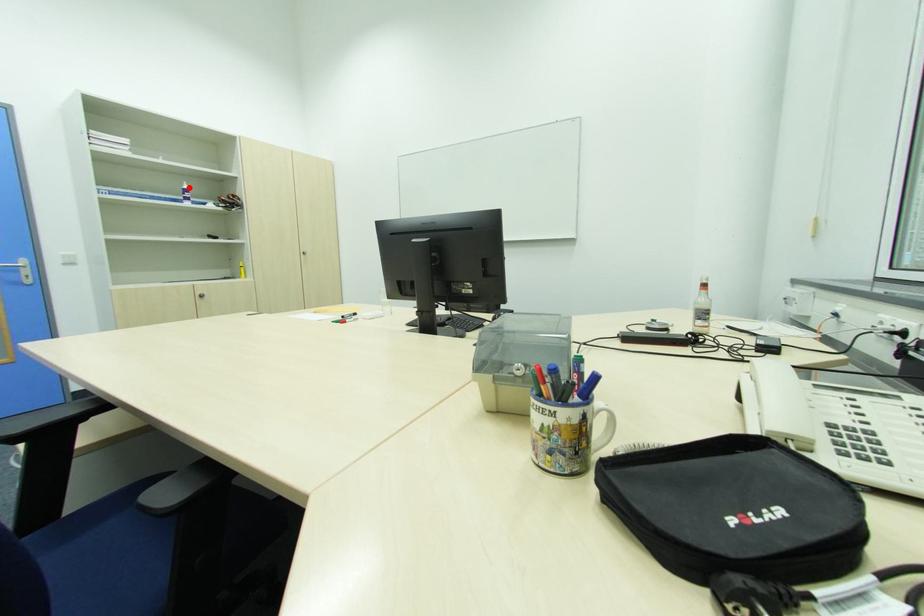
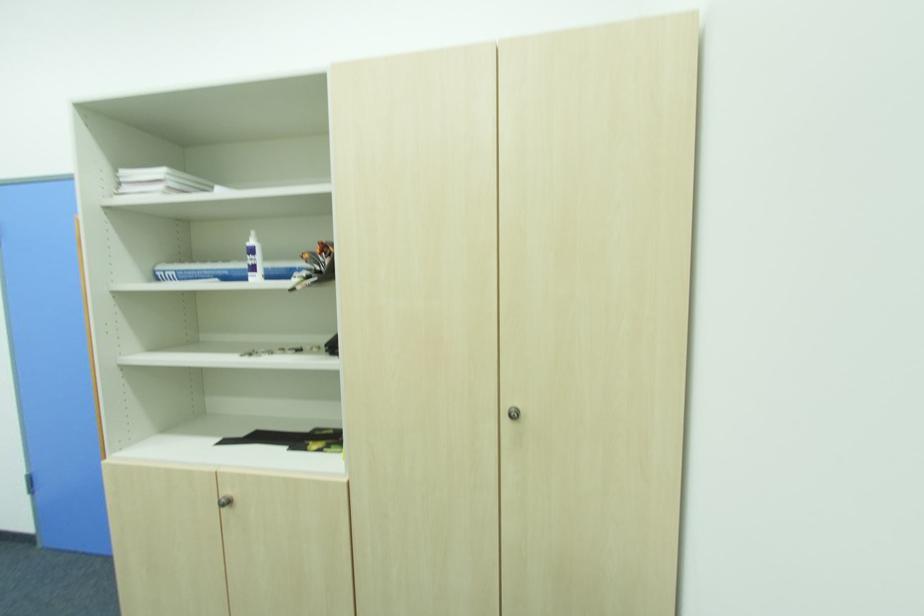
Locate, in the second image, the point that corresponds to the highlighted location in the first image.

(254, 243)